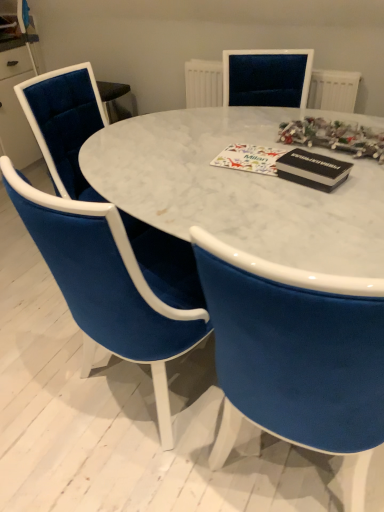
This screenshot has width=384, height=512. I want to click on free location to the right of black matte magazine at upper right, so click(363, 182).